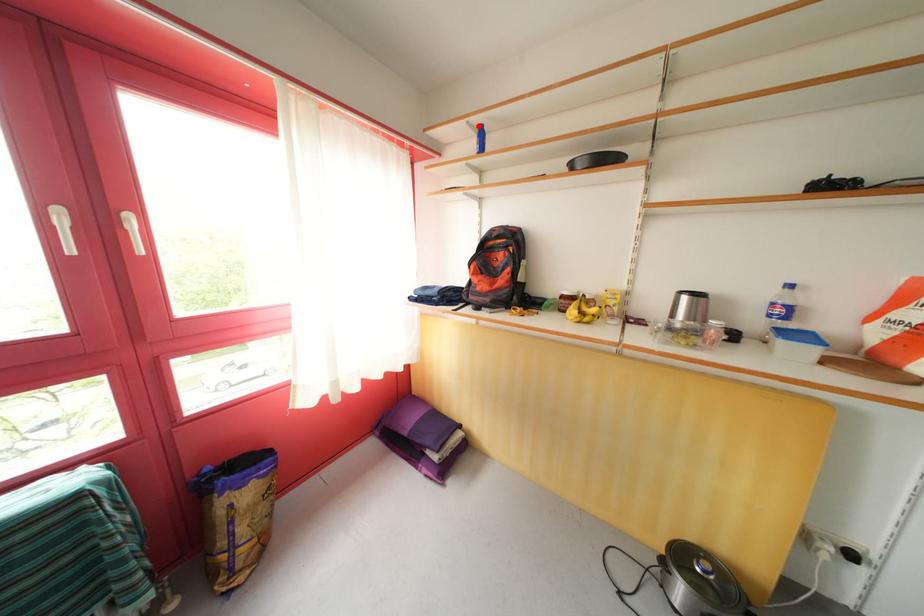
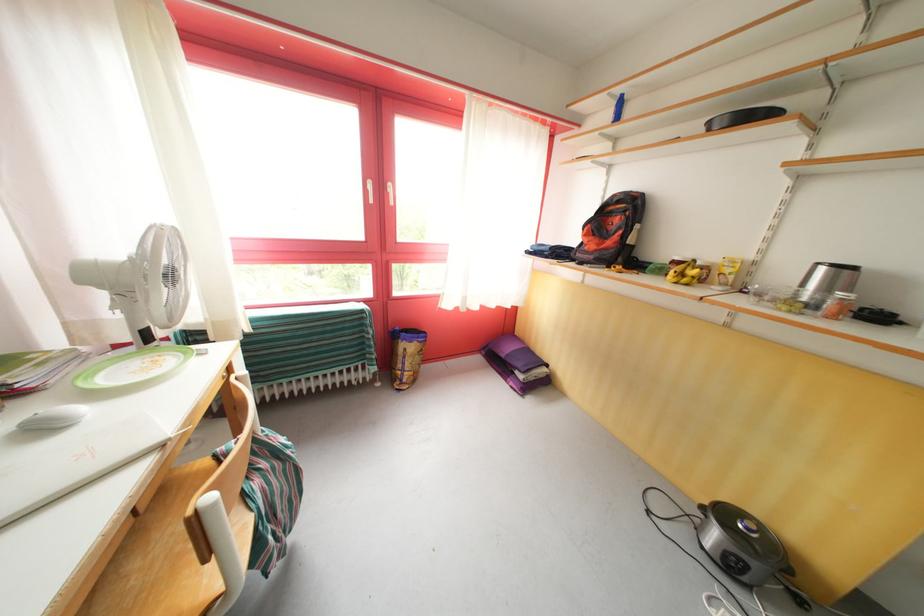
Locate, in the second image, the point that corresponds to the highlighted location in the first image.

(621, 95)